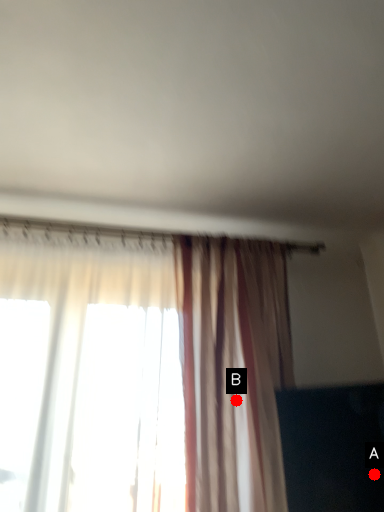
Question: Two points are circled on the image, labeled by A and B beside each circle. Which point is closer to the camera taking this photo?

Choices:
 (A) A is closer
 (B) B is closer

Answer: (A)